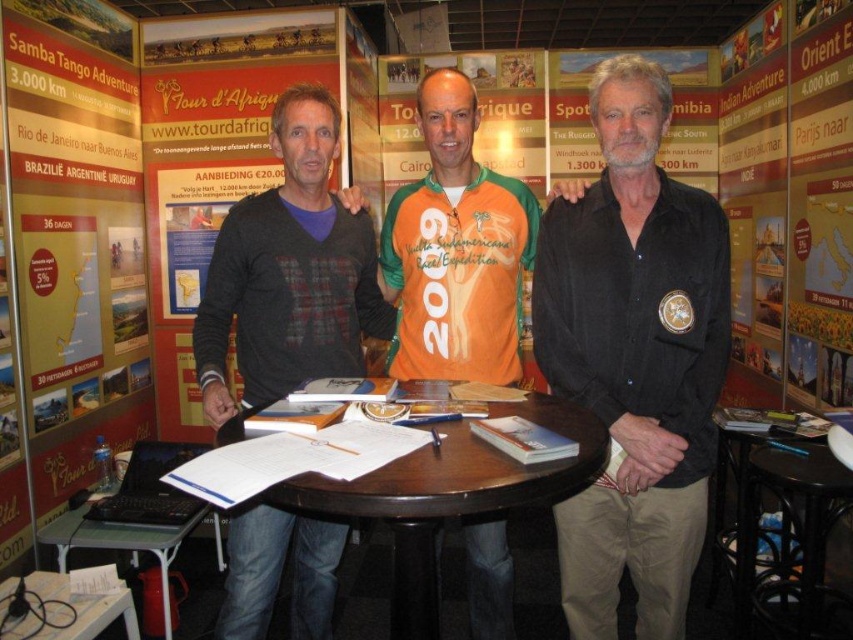
Does point (276, 131) lie behind point (166, 577)?

No.

Based on the photo, which of these two, dark gray sweater at center or metallic silver laptop at lower left, stands shorter?

With less height is metallic silver laptop at lower left.

Find the location of a particular element. The image size is (853, 640). dark gray sweater at center is located at coordinates (289, 272).

You are a GUI agent. You are given a task and a screenshot of the screen. Output one action in this format:
    pyautogui.click(x=<x>, y=<y>)
    Task: Click on the dark gray sweater at center
    This screenshot has width=853, height=640.
    Given the screenshot: What is the action you would take?
    pyautogui.click(x=289, y=272)

Is dark gray sweater at center thinner than orange jersey at center?

No, dark gray sweater at center is not thinner than orange jersey at center.

Which is behind, point (257, 570) or point (488, 570)?

The point (488, 570) is more distant.

The image size is (853, 640). I want to click on dark gray sweater at center, so click(289, 272).

Between orange jersey at center and metallic silver laptop at lower left, which one has more height?

Standing taller between the two is orange jersey at center.

Does point (401, 205) come in front of point (218, 552)?

Yes.

Does point (495, 353) lie in front of point (134, 538)?

Yes, point (495, 353) is in front of point (134, 538).

In order to click on orange jersey at center in this screenshot , I will do `click(456, 250)`.